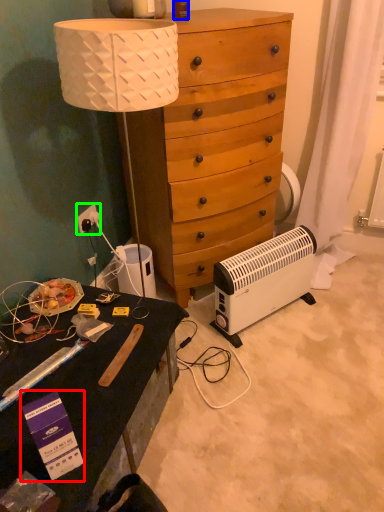
Question: Which is nearer to the box (highlighted by a red box)? bottle (highlighted by a blue box) or power outlet (highlighted by a green box).

Choices:
 (A) bottle
 (B) power outlet

Answer: (B)